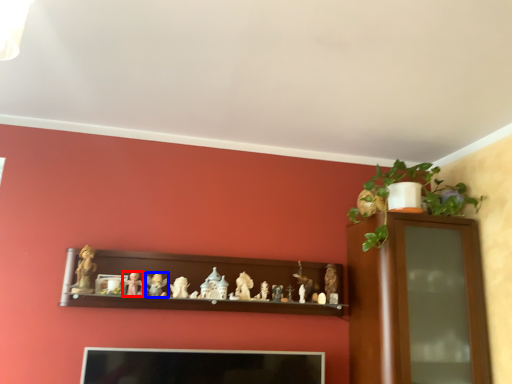
Question: Which object appears closest to the camera in this image, toy (highlighted by a red box) or toy (highlighted by a blue box)?

Choices:
 (A) toy
 (B) toy

Answer: (A)